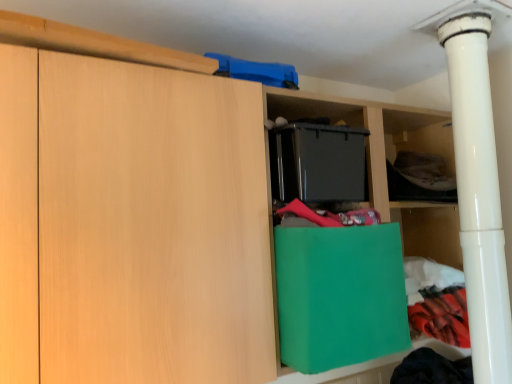
Question: Considering the positions of point (458, 198) and point (373, 340), is point (458, 198) closer or farther from the camera than point (373, 340)?

Choices:
 (A) farther
 (B) closer

Answer: (A)

Question: Which is correct: white glossy pipe at right is inside green paper bag at center, or outside of it?

Choices:
 (A) outside
 (B) inside

Answer: (A)

Question: Based on their relative distances, which object is farther from the dark gray fabric at upper right?

Choices:
 (A) white glossy pipe at right
 (B) green paper bag at center

Answer: (B)

Question: Which of these objects is positioned farthest from the white glossy pipe at right?

Choices:
 (A) green paper bag at center
 (B) dark gray fabric at upper right

Answer: (A)